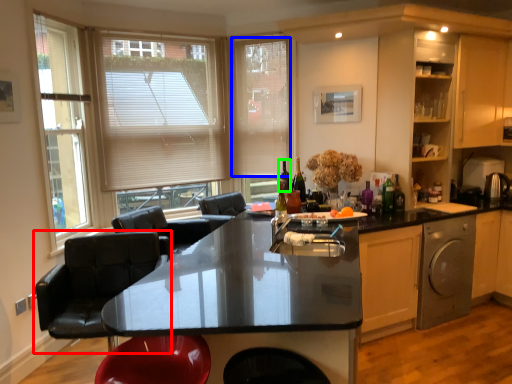
Question: Which object is the closest to the chair (highlighted by a red box)? Choose among these: blind (highlighted by a blue box) or wine bottle (highlighted by a green box).

Choices:
 (A) blind
 (B) wine bottle

Answer: (B)